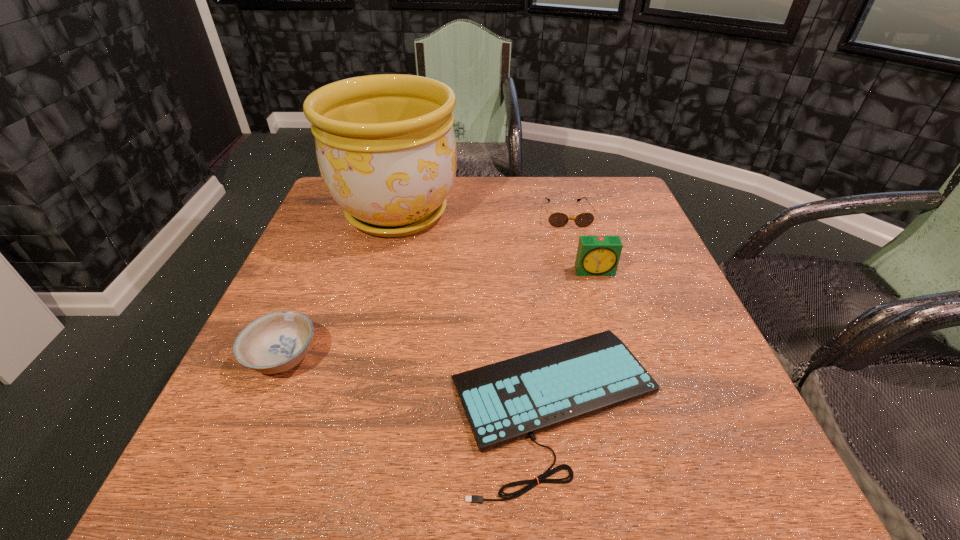
The width and height of the screenshot is (960, 540). I want to click on vacant space positioned on the back of the shortest object, so click(x=535, y=265).

The image size is (960, 540). Identify the location of flowerpot at the far edge. (385, 144).

The width and height of the screenshot is (960, 540). I want to click on sunglasses that is positioned at the far edge, so click(x=557, y=219).

You are a GUI agent. You are given a task and a screenshot of the screen. Output one action in this format:
    pyautogui.click(x=<x>, y=<y>)
    Task: Click on the object that is at the near edge
    
    Given the screenshot: What is the action you would take?
    pyautogui.click(x=506, y=401)

This screenshot has width=960, height=540. Identify the location of flowerpot that is at the left edge. (385, 144).

Find the location of a particular element. bowl that is positioned at the left edge is located at coordinates (276, 342).

Locate an element on the screen. This screenshot has width=960, height=540. alarm clock situated at the right edge is located at coordinates (596, 255).

Locate an element on the screen. sunglasses that is positioned at the right edge is located at coordinates (557, 219).

Identify the location of computer keyboard that is positioned at the right edge. (506, 401).

Identify the location of object situated at the far left corner. (385, 144).